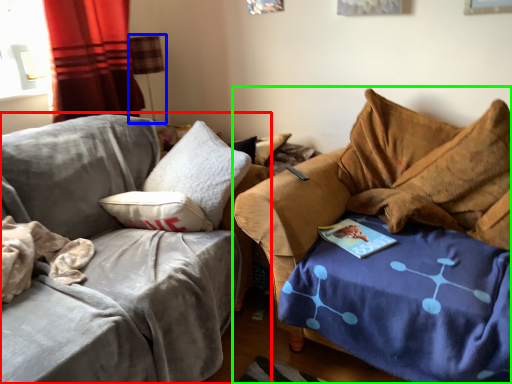
Question: Which object is positioned closest to studio couch (highlighted by a red box)? Select from lamp (highlighted by a blue box) and studio couch (highlighted by a green box).

Choices:
 (A) lamp
 (B) studio couch

Answer: (B)